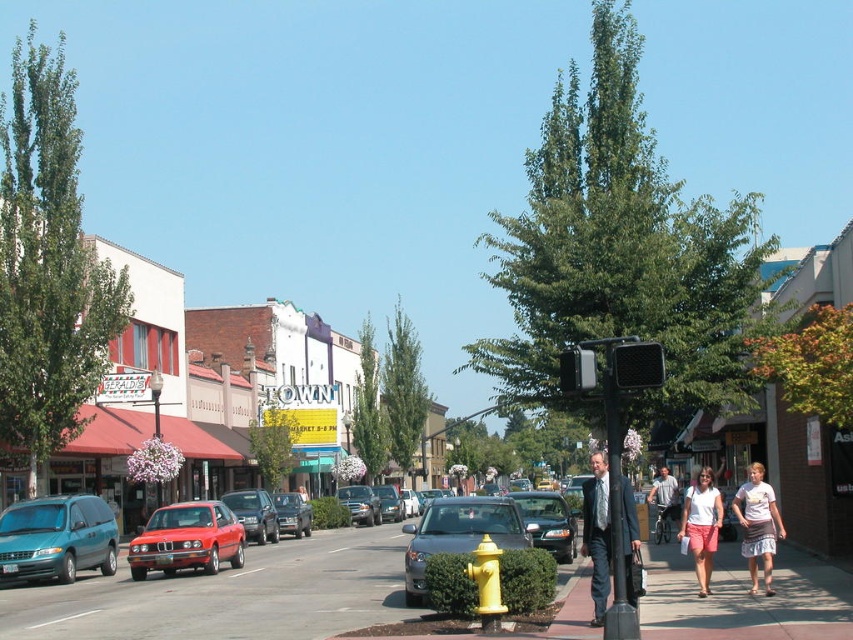
Question: Which of the following is the farthest from the observer?

Choices:
 (A) matte black car at center
 (B) matte red car at center
 (C) metallic gray sedan at center
 (D) yellow matte fire hydrant at center

Answer: (B)

Question: Does pavement at center appear over matte black car at center?

Choices:
 (A) no
 (B) yes

Answer: (A)

Question: Does pavement at center have a smaller size compared to matte red car at center?

Choices:
 (A) yes
 (B) no

Answer: (B)

Question: Which object is farther from the camera taking this photo?

Choices:
 (A) pavement at center
 (B) gray fabric shirt at center
 (C) shiny silver sedan at center

Answer: (C)

Question: Can you confirm if dark blue suit at center is positioned above metallic gray sedan at center?

Choices:
 (A) no
 (B) yes

Answer: (A)

Question: Estimate the real-world distances between objects in this image. Which object is closer to the white cotton shirt at center?

Choices:
 (A) shiny silver sedan at center
 (B) matte red car at center

Answer: (B)